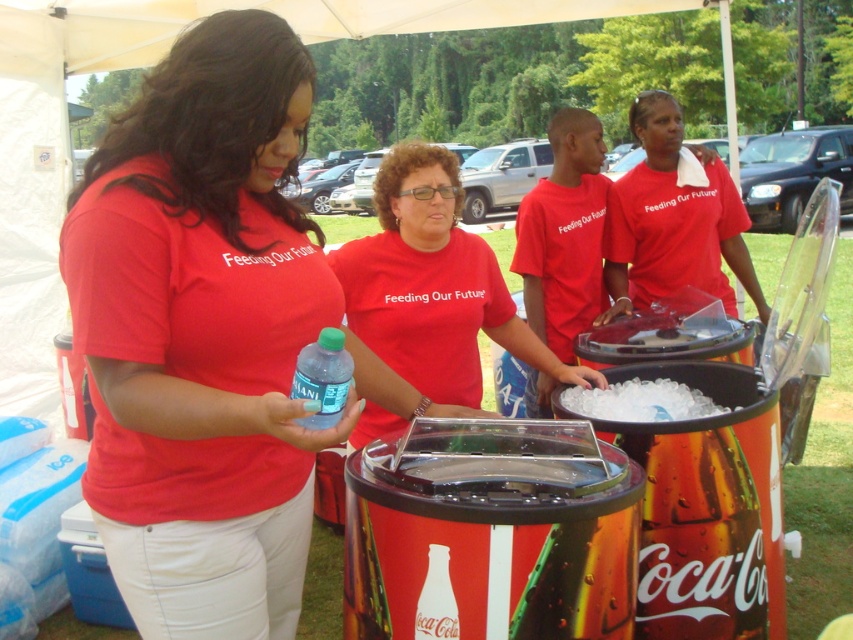
Question: Is clear plastic bottle at center bigger than translucent plastic bottle at center?

Choices:
 (A) yes
 (B) no

Answer: (A)

Question: Which of the following is the closest to the observer?

Choices:
 (A) clear plastic ice at center
 (B) translucent plastic bottle at center

Answer: (B)

Question: Observing the image, what is the correct spatial positioning of matte red shirt at center in reference to clear plastic ice at center?

Choices:
 (A) left
 (B) right

Answer: (A)

Question: Does clear plastic bottle at center have a smaller size compared to translucent plastic bottle at center?

Choices:
 (A) no
 (B) yes

Answer: (A)

Question: Which is nearer to the matte red shirt at center?

Choices:
 (A) translucent plastic bottle at center
 (B) clear plastic bottle at center
 (C) clear plastic ice at center

Answer: (B)

Question: Which point is farther to the camera?

Choices:
 (A) (264, 435)
 (B) (671, 420)
 (C) (300, 380)
 (D) (447, 548)

Answer: (B)